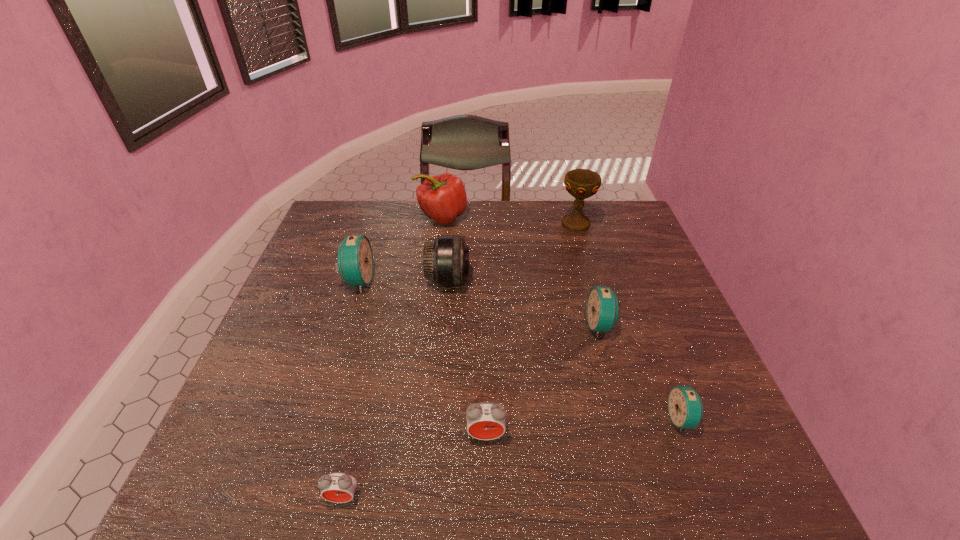
You are a GUI agent. You are given a task and a screenshot of the screen. Output one action in this format:
    pyautogui.click(x=<x>, y=<y>)
    Task: Click on the rightmost alarm clock
    The width and height of the screenshot is (960, 540).
    Given the screenshot: What is the action you would take?
    pyautogui.click(x=685, y=407)

You are a GUI agent. You are given a task and a screenshot of the screen. Output one action in this format:
    pyautogui.click(x=<x>, y=<y>)
    Task: Click on the nearest object
    
    Given the screenshot: What is the action you would take?
    pyautogui.click(x=338, y=487)

Locate an element on the screen. the nearer red alarm clock is located at coordinates (338, 487).

Identify the location of vacant area situated 0.300m on the front of the red chalice. (598, 299).

At what (x,y) coordinates should I click in order to perform the action: click on blank space located 0.160m on the left of the bell pepper. Please return your answer as a coordinate pair (x, y). Looking at the image, I should click on (368, 217).

You are a GUI agent. You are given a task and a screenshot of the screen. Output one action in this format:
    pyautogui.click(x=<x>, y=<y>)
    Task: Click on the blank space located on the front-facing side of the tallest alarm clock
    The image size is (960, 540).
    Given the screenshot: What is the action you would take?
    pyautogui.click(x=491, y=281)

Where is `vacant region located on the front-facing side of the telephoto lens`? vacant region located on the front-facing side of the telephoto lens is located at coordinates (512, 280).

What are the coordinates of `free space located 0.120m on the front-facing side of the second smallest blue alarm clock` in the screenshot? It's located at (540, 326).

Where is `blank space located on the front-facing side of the second smallest blue alarm clock`? Image resolution: width=960 pixels, height=540 pixels. blank space located on the front-facing side of the second smallest blue alarm clock is located at coordinates (475, 326).

Where is `free space located on the front-facing side of the second smallest blue alarm clock`? free space located on the front-facing side of the second smallest blue alarm clock is located at coordinates (499, 326).